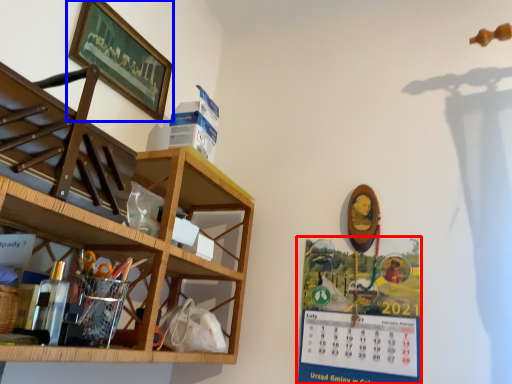
Question: Which object is closer to the camera taking this photo, poster (highlighted by a red box) or picture frame (highlighted by a blue box)?

Choices:
 (A) poster
 (B) picture frame

Answer: (A)